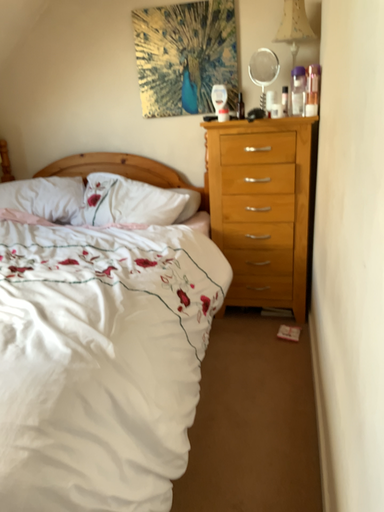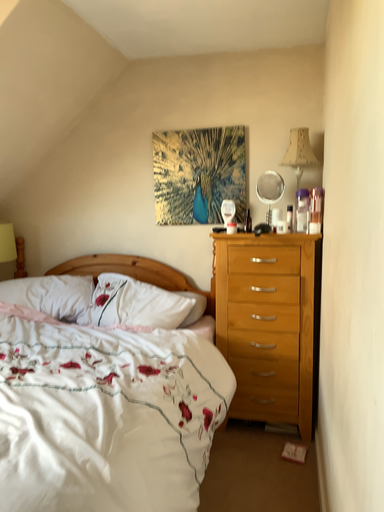
Question: Which way did the camera rotate in the video?

Choices:
 (A) rotated downward
 (B) rotated upward

Answer: (B)